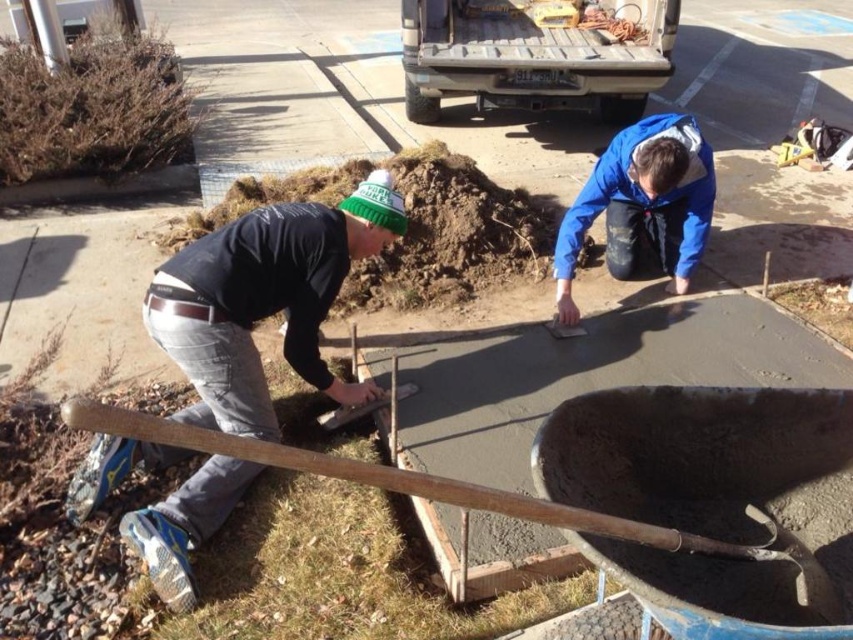
At what (x,y) coordinates should I click in order to perform the action: click on blue matte jacket at center. Please return your answer as a coordinate pair (x, y). The image size is (853, 640). Looking at the image, I should click on point(642,204).

In the scene shown: Who is taller, blue matte jacket at center or wooden shovel at lower left?

With more height is blue matte jacket at center.

Locate an element on the screen. blue matte jacket at center is located at coordinates (642, 204).

Does dark gray jeans at lower left appear over blue matte jacket at center?

Actually, dark gray jeans at lower left is below blue matte jacket at center.

Where is `dark gray jeans at lower left`? The height and width of the screenshot is (640, 853). dark gray jeans at lower left is located at coordinates (265, 300).

Which is below, dark gray jeans at lower left or wooden shovel at lower left?

wooden shovel at lower left is lower down.

Is dark gray jeans at lower left to the right of wooden shovel at lower left from the viewer's perspective?

No, dark gray jeans at lower left is not to the right of wooden shovel at lower left.

The height and width of the screenshot is (640, 853). Identify the location of dark gray jeans at lower left. (265, 300).